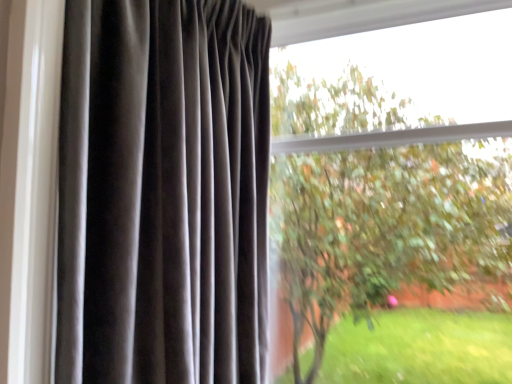
What do you see at coordinates (163, 192) in the screenshot? The width and height of the screenshot is (512, 384). I see `satin black curtain at left` at bounding box center [163, 192].

Locate an element on the screen. The image size is (512, 384). satin black curtain at left is located at coordinates (163, 192).

You are a GUI agent. You are given a task and a screenshot of the screen. Output one action in this format:
    pyautogui.click(x=<x>, y=<y>)
    Task: Click on the satin black curtain at left
    
    Given the screenshot: What is the action you would take?
    pyautogui.click(x=163, y=192)